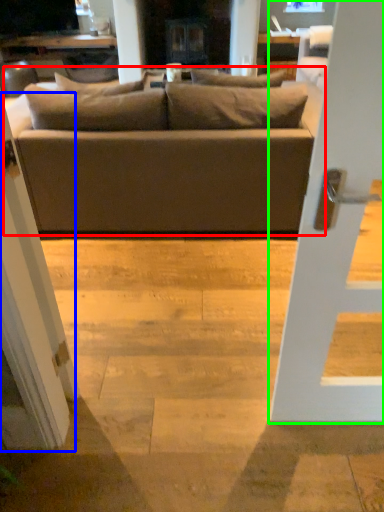
Question: Which is farther away from studio couch (highlighted by a red box)? screen door (highlighted by a blue box) or door (highlighted by a green box)?

Choices:
 (A) screen door
 (B) door

Answer: (B)